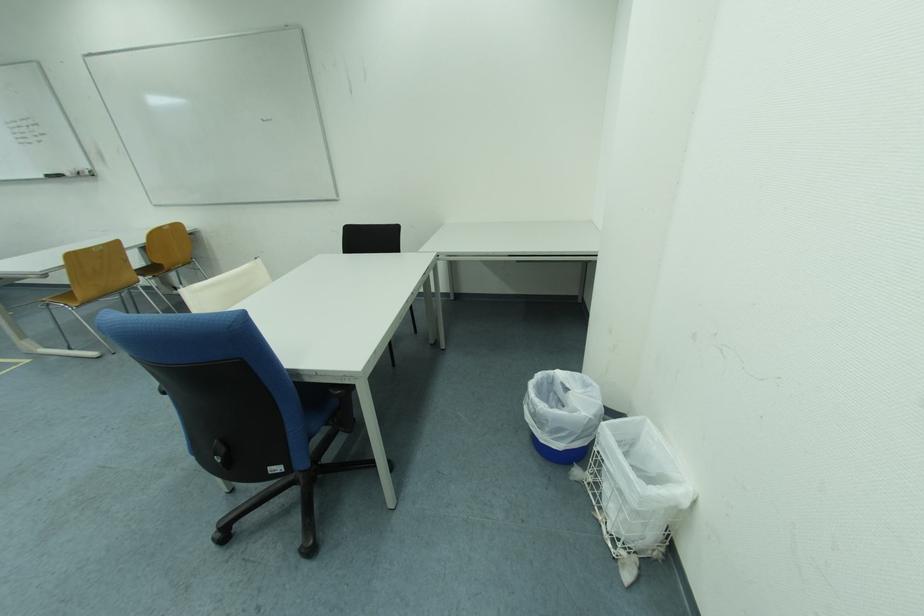
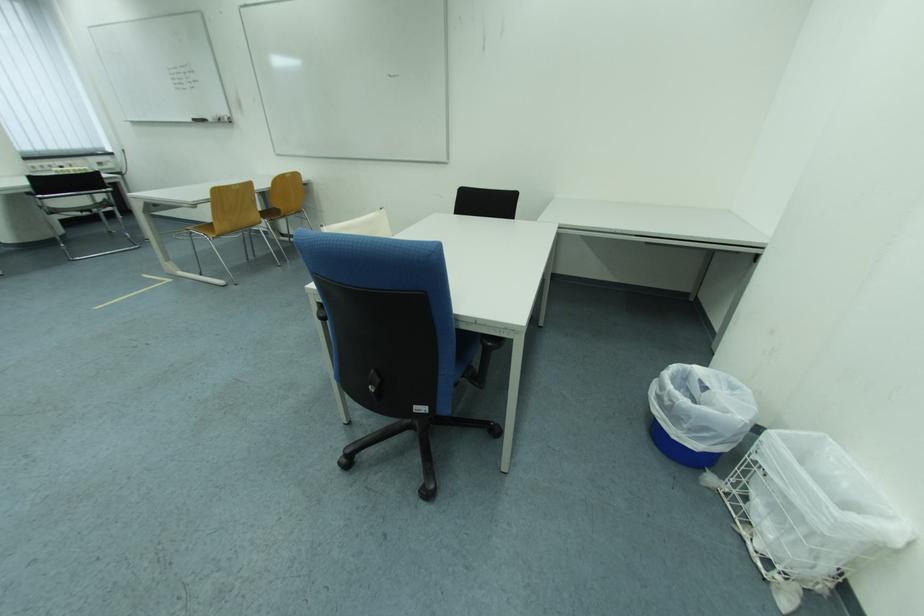
Find the pixel in the second image that matches the point at 603,517 in the first image.

(745, 532)